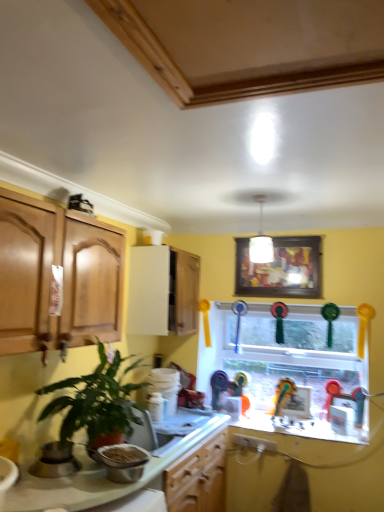
Question: Is wooden framed picture at upper center closer to the viewer compared to satin silver pot at lower left, which is the second appliance in right-to-left order?

Choices:
 (A) no
 (B) yes

Answer: (A)

Question: Is wooden framed picture at upper center not close to satin silver pot at lower left, which is the second appliance in right-to-left order?

Choices:
 (A) yes
 (B) no

Answer: (A)

Question: Would you say wooden framed picture at upper center contains satin silver pot at lower left, the first appliance positioned from the left?

Choices:
 (A) no
 (B) yes

Answer: (A)

Question: Is wooden framed picture at upper center directly adjacent to satin silver pot at lower left, which is the second appliance in right-to-left order?

Choices:
 (A) no
 (B) yes

Answer: (A)

Question: From the image's perspective, is wooden framed picture at upper center under satin silver pot at lower left, which is the second appliance in right-to-left order?

Choices:
 (A) no
 (B) yes

Answer: (A)

Question: From a real-world perspective, is wooden framed picture at upper center located beneath satin silver pot at lower left, which is the second appliance in right-to-left order?

Choices:
 (A) yes
 (B) no

Answer: (B)

Question: Is glass window at center beside satin silver pot at lower left, the first appliance positioned from the left?

Choices:
 (A) yes
 (B) no

Answer: (B)

Question: Considering the relative sizes of glass window at center and satin silver pot at lower left, the first appliance positioned from the left, in the image provided, is glass window at center taller than satin silver pot at lower left, the first appliance positioned from the left,?

Choices:
 (A) no
 (B) yes

Answer: (B)

Question: Considering the relative sizes of glass window at center and satin silver pot at lower left, the first appliance positioned from the left, in the image provided, is glass window at center wider than satin silver pot at lower left, the first appliance positioned from the left,?

Choices:
 (A) yes
 (B) no

Answer: (B)

Question: Is glass window at center to the right of satin silver pot at lower left, the first appliance positioned from the left, from the viewer's perspective?

Choices:
 (A) yes
 (B) no

Answer: (A)

Question: Is the depth of glass window at center greater than that of satin silver pot at lower left, the first appliance positioned from the left?

Choices:
 (A) yes
 (B) no

Answer: (A)

Question: Can you confirm if glass window at center is positioned to the left of satin silver pot at lower left, the first appliance positioned from the left?

Choices:
 (A) yes
 (B) no

Answer: (B)

Question: From the image's perspective, does white glossy cabinet at upper center appear lower than metallic silver bowl at lower left, which appears as the first appliance when viewed from the right?

Choices:
 (A) yes
 (B) no

Answer: (B)